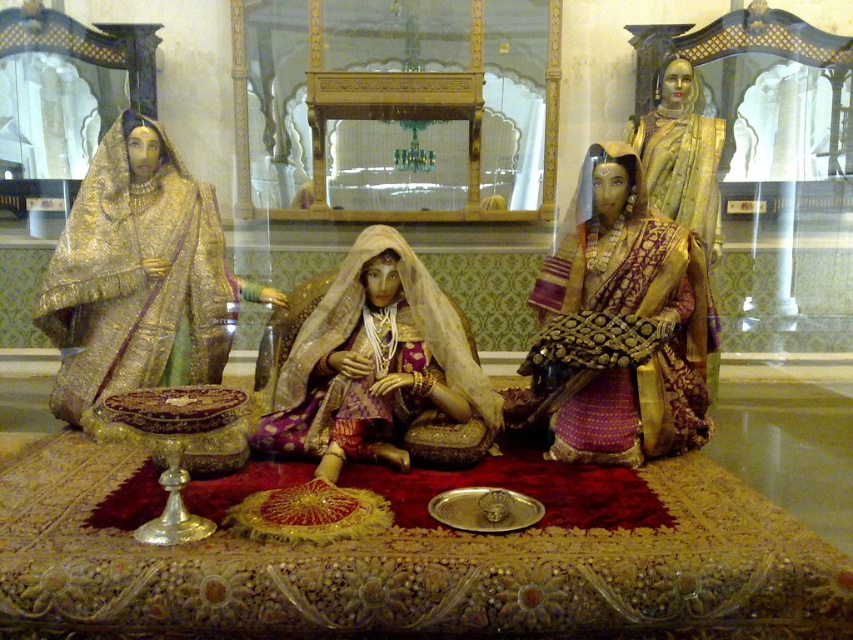
Based on the photo, you are a visitor at the museum exhibit and want to take a photo of both the gold silk saree at center and the gold embroidered dress at left. Which one should you focus on first if you want to capture both in the same frame?

You should focus on the gold silk saree at center first because it is closer to the viewer than the gold embroidered dress at left, so adjusting the focus to it will help ensure both are in the frame.

You are a visitor in the museum and want to take a photo of the two points mentioned. Which point is closer to you, the point at coordinates point (198, 209) or point (654, 154)?

Point (198, 209) is in front of point (654, 154), so it is closer to you.

You are a museum curator planning to install a new display case between the two gold silk sarees. The display case requires a minimum of 24 inches of space between them. Based on the current arrangement, will the display case fit between the gold silk saree at center and the gold silk saree at upper right?

The distance between the gold silk saree at center and the gold silk saree at upper right is 23.04 inches, which is less than the required 24 inches. Therefore, the display case cannot be placed between them as there isn not enough space.